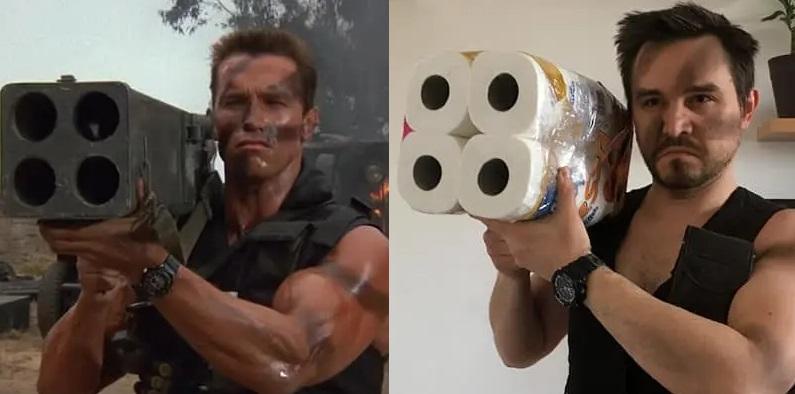
This screenshot has width=795, height=394. Find the location of `inside paper towel roll`. inside paper towel roll is located at coordinates (420, 177), (489, 174), (506, 94), (429, 86).